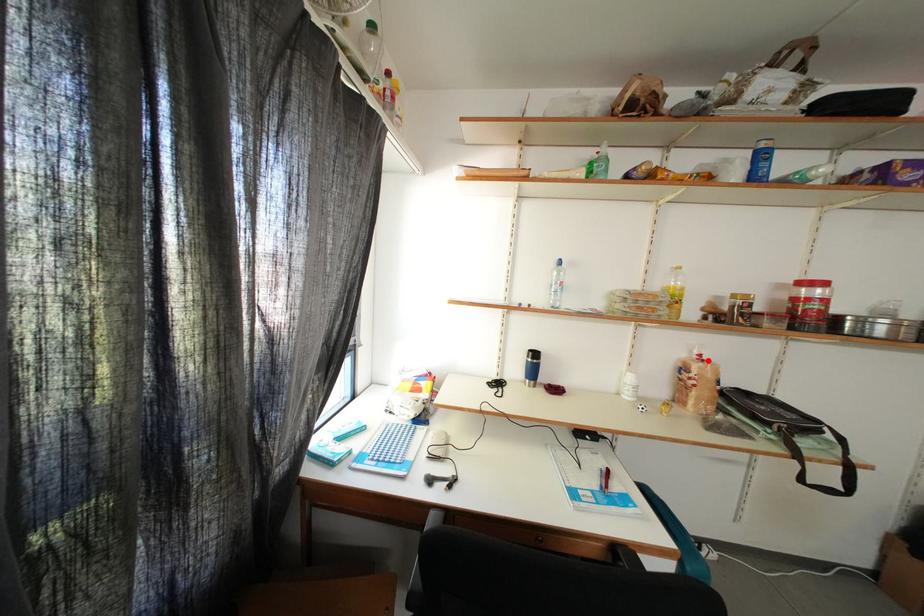
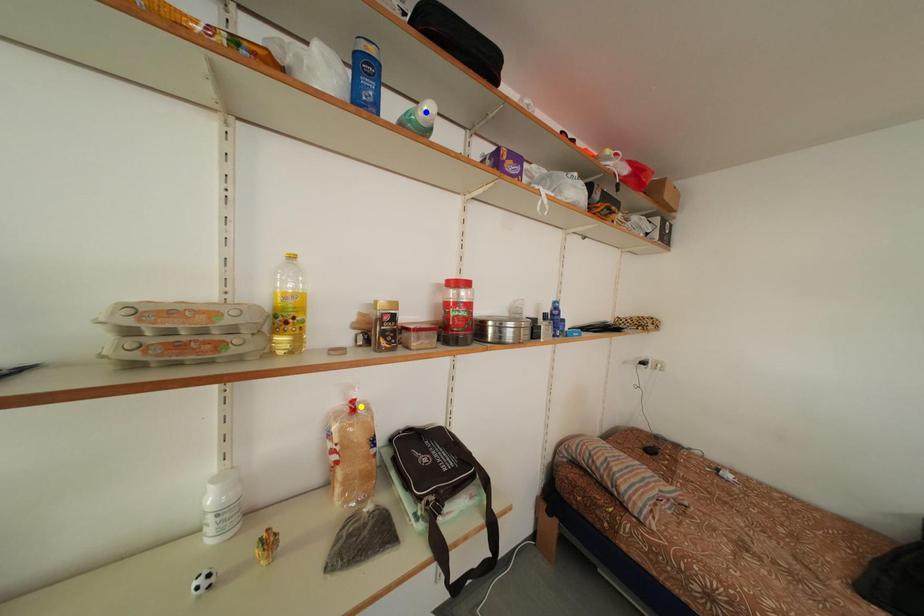
Question: I am providing you with two images of the same scene from different viewpoints. A red point is marked on the first image. You are given multiple points on the second image. In image 2, which mark is for the same physical point as the one in image 1?

Choices:
 (A) green point
 (B) blue point
 (C) yellow point

Answer: (C)